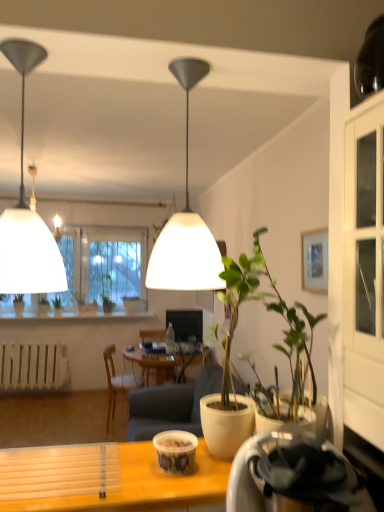
Find the location of a particular element. This screenshot has height=512, width=384. empty space that is ontop of wooden desk at lower center (from a real-world perspective) is located at coordinates (130, 475).